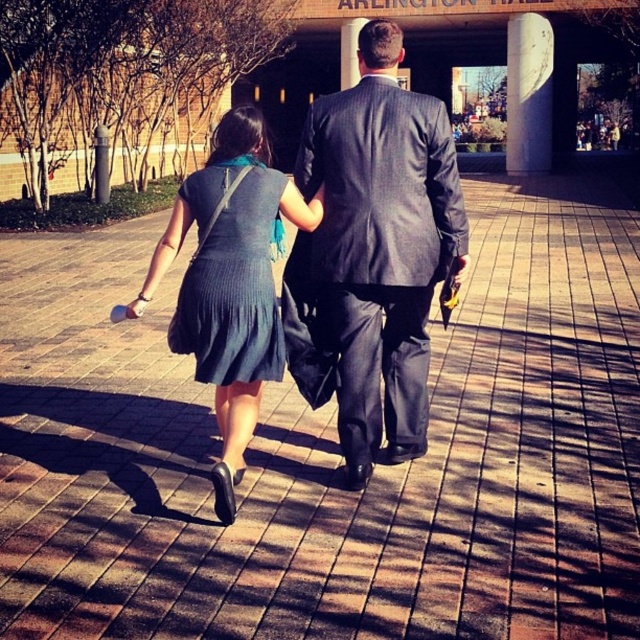
Question: Among these objects, which one is farthest from the camera?

Choices:
 (A) knit fabric dress at center-left
 (B) gray suit at center

Answer: (B)

Question: Which object appears closest to the camera in this image?

Choices:
 (A) matte black dress at center
 (B) gray suit at center
 (C) knit fabric dress at center

Answer: (C)

Question: Is matte black dress at center positioned at the back of knit fabric dress at center-left?

Choices:
 (A) no
 (B) yes

Answer: (B)

Question: Is knit fabric dress at center-left thinner than knit fabric dress at center?

Choices:
 (A) no
 (B) yes

Answer: (A)

Question: Which of the following is the closest to the observer?

Choices:
 (A) white marble pillar at upper right
 (B) knit fabric dress at center
 (C) knit fabric dress at center-left
 (D) gray suit at center

Answer: (C)

Question: Is knit fabric dress at center bigger than white marble pillar at upper right?

Choices:
 (A) no
 (B) yes

Answer: (B)